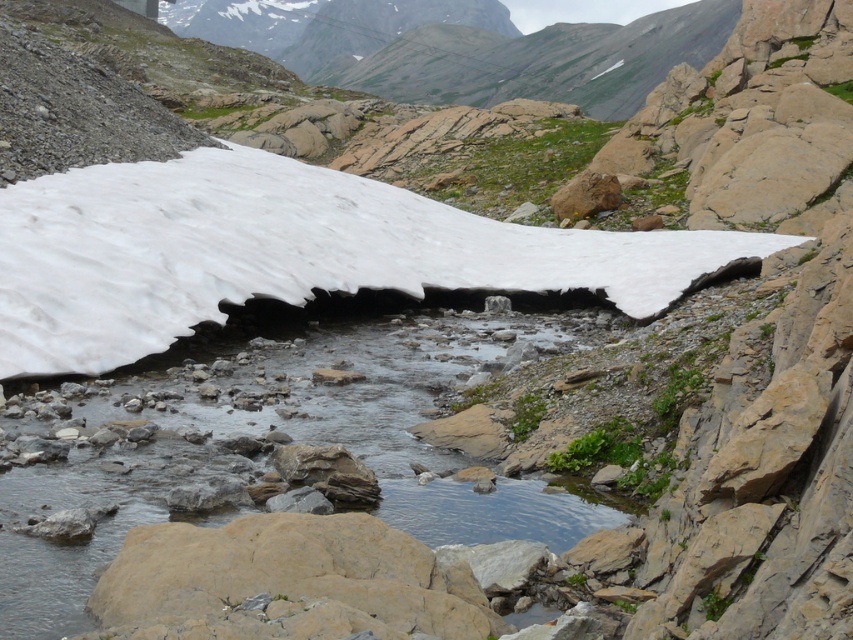
You are a hiker who wants to take a photo of the white matte snow at upper center. Based on the scene, where should you position yourself to capture the snow in the upper center of your camera frame?

To capture the white matte snow at upper center in the upper center of your camera frame, position yourself so that the snow is centered in the upper portion of your viewfinder, aligning it with the coordinates approximately at point [283,252].

From the picture: You are a hiker planning to cross the stream in the mountainous landscape. The white matte snow at upper center is above the clear water at center. Which object is higher in elevation?

The white matte snow at upper center has a greater height compared to the clear water at center, so it is higher in elevation.